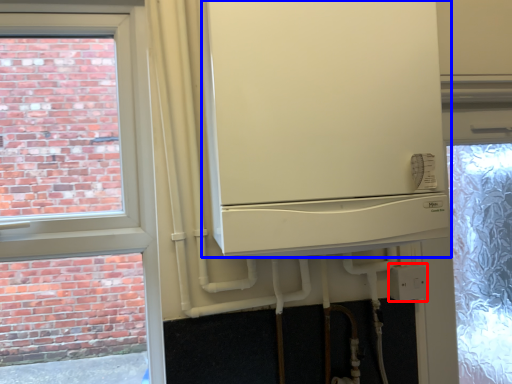
Question: Which of the following is the closest to the observer, electric outlet (highlighted by a red box) or fridge (highlighted by a blue box)?

Choices:
 (A) electric outlet
 (B) fridge

Answer: (B)